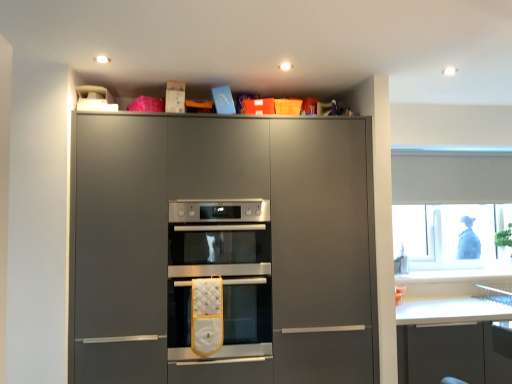
Question: Considering the relative positions of satin silver oven at center, which ranks as the second oven in bottom-to-top order, and white quilted oven mitt at center, the second oven viewed from the top, in the image provided, is satin silver oven at center, which ranks as the second oven in bottom-to-top order, to the left or to the right of white quilted oven mitt at center, the second oven viewed from the top,?

Choices:
 (A) left
 (B) right

Answer: (A)

Question: Considering the positions of satin silver oven at center, which ranks as the second oven in bottom-to-top order, and white quilted oven mitt at center, the second oven viewed from the top, in the image, is satin silver oven at center, which ranks as the second oven in bottom-to-top order, wider or thinner than white quilted oven mitt at center, the second oven viewed from the top,?

Choices:
 (A) thin
 (B) wide

Answer: (A)

Question: Which object is the closest to the white quilted oven mitt at center, which is the first oven from bottom to top?

Choices:
 (A) satin silver oven at center, which ranks as the second oven in bottom-to-top order
 (B) transparent plastic window at upper right
 (C) matte gray oven at center

Answer: (A)

Question: Estimate the real-world distances between objects in this image. Which object is closer to the satin silver oven at center, which ranks as the second oven in bottom-to-top order?

Choices:
 (A) matte gray oven at center
 (B) transparent plastic window at upper right
 (C) white quilted oven mitt at center, which is the first oven from bottom to top

Answer: (A)